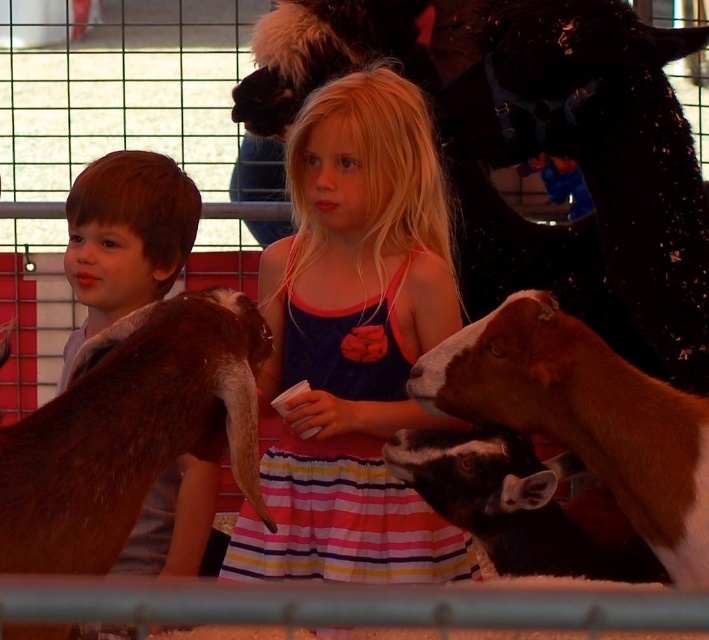
You are a photographer trying to capture a photo of the brown fuzzy goat at lower right without the matte blue dress at center blocking the view. Is the dress currently in the way of the goat?

The matte blue dress at center is above the brown fuzzy goat at lower right, so the dress is blocking the view of the goat from below. To capture the photo without the dress blocking the view, you would need to adjust your angle or position to position the dress out of the frame or lower your camera to avoid the dress.

You are a photographer trying to capture the matte blue dress at center in your shot. Based on the scene, where should you position yourself to ensure the dress is centered in your photo?

The matte blue dress at center is already positioned at the center coordinates of the image, so positioning yourself directly in front of it would ensure it remains centered in your photo.

You are a parent trying to locate your child in the petting zoo. Your child is wearing a colorful striped dress with pink, yellow, and white stripes. Where should you look relative to the brown fur at left and the brown fuzzy goat at lower right?

The brown fuzzy goat at lower right is to the right of the brown fur at left. Since the girl in the colorful striped dress is next to the boy, who is on the left, she is likely near the brown fuzzy goat at lower right.